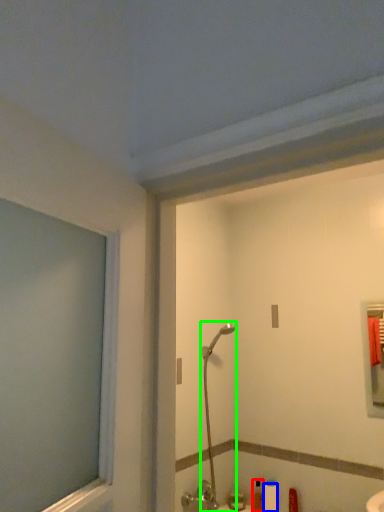
Question: Considering the real-world distances, which object is closest to toiletry (highlighted by a red box)? toilet paper (highlighted by a blue box) or shower (highlighted by a green box).

Choices:
 (A) toilet paper
 (B) shower

Answer: (A)